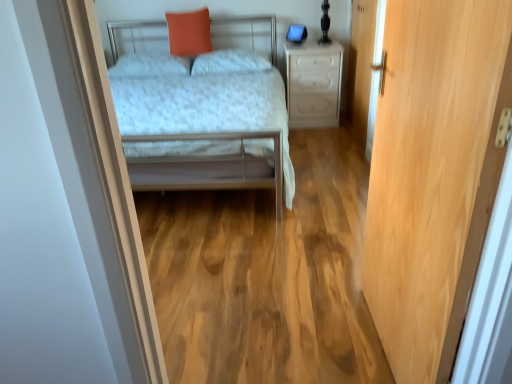
In order to click on wooden door at right in this screenshot , I will do `click(361, 63)`.

I want to click on white soft pillow at center, acting as the 2th pillow starting from the right, so click(x=150, y=65).

Find the location of a particular element. This screenshot has width=512, height=384. light wood door at right is located at coordinates (434, 174).

What is the approximate height of white soft pillow at center, which is the first pillow in right-to-left order?

The height of white soft pillow at center, which is the first pillow in right-to-left order, is 6.54 inches.

You are a GUI agent. You are given a task and a screenshot of the screen. Output one action in this format:
    pyautogui.click(x=<x>, y=<y>)
    Task: Click on the wooden door at right
    This screenshot has height=384, width=512.
    Given the screenshot: What is the action you would take?
    pyautogui.click(x=361, y=63)

Is orange matte pillow at upper center surrounding white soft pillow at center, which is the first pillow from left to right?

No, orange matte pillow at upper center does not contain white soft pillow at center, which is the first pillow from left to right.

Measure the distance from orange matte pillow at upper center to white soft pillow at center, acting as the 2th pillow starting from the right.

orange matte pillow at upper center is 26.18 centimeters from white soft pillow at center, acting as the 2th pillow starting from the right.

From the image's perspective, is orange matte pillow at upper center above white soft pillow at center, acting as the 2th pillow starting from the right?

Correct, orange matte pillow at upper center appears higher than white soft pillow at center, acting as the 2th pillow starting from the right, in the image.

Which object is further away from the camera, orange matte pillow at upper center or white soft pillow at center, which is the first pillow from left to right?

orange matte pillow at upper center is more distant.

Looking at this image, does metallic silver bed at center have a greater height compared to light wood door at right?

In fact, metallic silver bed at center may be shorter than light wood door at right.

Is metallic silver bed at center to the left of light wood door at right from the viewer's perspective?

Indeed, metallic silver bed at center is positioned on the left side of light wood door at right.

Is light wood door at right completely or partially inside metallic silver bed at center?

No, light wood door at right is located outside of metallic silver bed at center.

From the image's perspective, which is above, metallic silver bed at center or light wood door at right?

metallic silver bed at center, from the image's perspective.

Is light wood door at right shorter than white soft pillow at center, which ranks as the second pillow in left-to-right order?

No, light wood door at right is not shorter than white soft pillow at center, which ranks as the second pillow in left-to-right order.

Would you say light wood door at right is outside white soft pillow at center, which is the first pillow in right-to-left order?

Indeed, light wood door at right is completely outside white soft pillow at center, which is the first pillow in right-to-left order.

Considering the sizes of objects light wood door at right and white soft pillow at center, which is the first pillow in right-to-left order, in the image provided, who is wider, light wood door at right or white soft pillow at center, which is the first pillow in right-to-left order,?

Wider between the two is white soft pillow at center, which is the first pillow in right-to-left order.

Can you confirm if metallic silver bed at center is positioned to the right of white soft pillow at center, acting as the 2th pillow starting from the right?

Yes, metallic silver bed at center is to the right of white soft pillow at center, acting as the 2th pillow starting from the right.

Is metallic silver bed at center facing towards white soft pillow at center, which is the first pillow from left to right?

No.

Who is smaller, metallic silver bed at center or white soft pillow at center, acting as the 2th pillow starting from the right?

white soft pillow at center, acting as the 2th pillow starting from the right, is smaller.

Can you tell me how much metallic silver bed at center and white soft pillow at center, which is the first pillow from left to right, differ in facing direction?

0.033 degrees separate the facing orientations of metallic silver bed at center and white soft pillow at center, which is the first pillow from left to right.

Considering the positions of objects orange matte pillow at upper center and wooden door at right in the image provided, who is more to the left, orange matte pillow at upper center or wooden door at right?

orange matte pillow at upper center is more to the left.

Can you confirm if orange matte pillow at upper center is wider than wooden door at right?

→ Yes, orange matte pillow at upper center is wider than wooden door at right.

Does orange matte pillow at upper center turn towards wooden door at right?

No.

Which is nearer, (170, 34) or (370, 53)?

Point (170, 34).

Does orange matte pillow at upper center have a greater width compared to metallic silver bed at center?

Incorrect, the width of orange matte pillow at upper center does not surpass that of metallic silver bed at center.

Which is in front, point (183, 25) or point (216, 150)?

The point (216, 150) is closer to the camera.

Where is `bed below the orange matte pillow at upper center (from a real-world perspective)`? The width and height of the screenshot is (512, 384). bed below the orange matte pillow at upper center (from a real-world perspective) is located at coordinates (203, 118).

Is orange matte pillow at upper center facing away from metallic silver bed at center?

Yes.

From a real-world perspective, who is located higher, white soft pillow at center, acting as the 2th pillow starting from the right, or wooden door at right?

white soft pillow at center, acting as the 2th pillow starting from the right.

Between white soft pillow at center, acting as the 2th pillow starting from the right, and wooden door at right, which one has more height?

Standing taller between the two is wooden door at right.

Is white soft pillow at center, acting as the 2th pillow starting from the right, oriented towards wooden door at right?

No, white soft pillow at center, acting as the 2th pillow starting from the right, is not facing towards wooden door at right.

The height and width of the screenshot is (384, 512). What are the coordinates of `throw pillow on the right side of white soft pillow at center, acting as the 2th pillow starting from the right` in the screenshot? It's located at (189, 33).

The height and width of the screenshot is (384, 512). Identify the location of door in front of the metallic silver bed at center. (434, 174).

Which object lies nearer to the anchor point wooden door at right, metallic silver bed at center or white soft pillow at center, which is the first pillow in right-to-left order?

white soft pillow at center, which is the first pillow in right-to-left order, is closer to wooden door at right.

Which object lies nearer to the anchor point light wood door at right, orange matte pillow at upper center or white soft pillow at center, acting as the 2th pillow starting from the right?

The object closer to light wood door at right is white soft pillow at center, acting as the 2th pillow starting from the right.

From the picture: Estimate the real-world distances between objects in this image. Which object is closer to metallic silver bed at center, light wood door at right or white soft pillow at center, which ranks as the second pillow in left-to-right order?

white soft pillow at center, which ranks as the second pillow in left-to-right order, lies closer to metallic silver bed at center than the other object.

Based on their spatial positions, is wooden door at right or white plastic drawer at center further from metallic silver bed at center?

Based on the image, wooden door at right appears to be further to metallic silver bed at center.

Which object lies nearer to the anchor point white soft pillow at center, which is the first pillow in right-to-left order, light wood door at right or metallic silver bed at center?

Based on the image, metallic silver bed at center appears to be nearer to white soft pillow at center, which is the first pillow in right-to-left order.

Which object lies further to the anchor point orange matte pillow at upper center, white soft pillow at center, which is the first pillow from left to right, or metallic silver bed at center?

metallic silver bed at center.

From the image, which object appears to be nearer to white plastic drawer at center, light wood door at right or white soft pillow at center, which is the first pillow from left to right?

The object closer to white plastic drawer at center is white soft pillow at center, which is the first pillow from left to right.

When comparing their distances from orange matte pillow at upper center, does wooden door at right or white plastic drawer at center seem further?

wooden door at right.

What are the coordinates of `nightstand positioned between light wood door at right and white soft pillow at center, which ranks as the second pillow in left-to-right order, from near to far` in the screenshot? It's located at (313, 84).

Where is `nightstand situated between orange matte pillow at upper center and wooden door at right from left to right`? Image resolution: width=512 pixels, height=384 pixels. nightstand situated between orange matte pillow at upper center and wooden door at right from left to right is located at coordinates (313, 84).

Where is `throw pillow between white soft pillow at center, which is the first pillow from left to right, and white soft pillow at center, which is the first pillow in right-to-left order`? throw pillow between white soft pillow at center, which is the first pillow from left to right, and white soft pillow at center, which is the first pillow in right-to-left order is located at coordinates (189, 33).

You are a GUI agent. You are given a task and a screenshot of the screen. Output one action in this format:
    pyautogui.click(x=<x>, y=<y>)
    Task: Click on the pillow between white soft pillow at center, which is the first pillow from left to right, and wooden door at right, in the horizontal direction
    
    Given the screenshot: What is the action you would take?
    pyautogui.click(x=229, y=62)